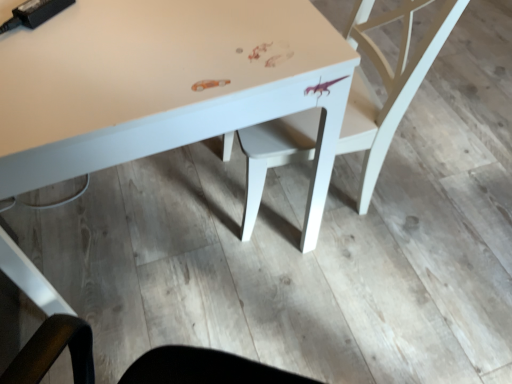
This screenshot has width=512, height=384. I want to click on unoccupied region to the right of white matte chair at center, so click(435, 193).